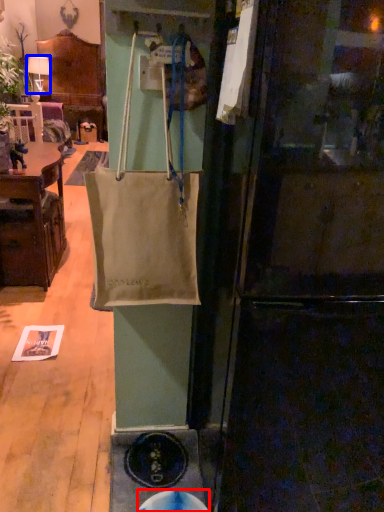
Question: Among these objects, which one is farthest to the camera, manhole (highlighted by a red box) or lamp (highlighted by a blue box)?

Choices:
 (A) manhole
 (B) lamp

Answer: (B)